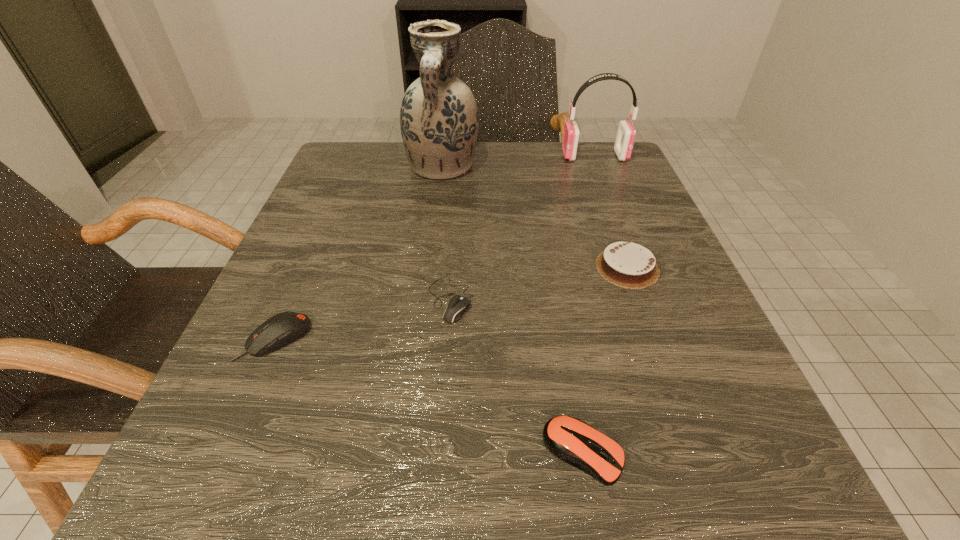
At what (x,y) coordinates should I click in order to perform the action: click on vacant space located on the outer surface of the earphone. Please return your answer as a coordinate pair (x, y). This screenshot has width=960, height=540. Looking at the image, I should click on (468, 156).

Where is `vacant space located 0.260m on the outer surface of the earphone`? Image resolution: width=960 pixels, height=540 pixels. vacant space located 0.260m on the outer surface of the earphone is located at coordinates (450, 156).

Where is `free spot located 0.150m on the front of the leftmost object`? free spot located 0.150m on the front of the leftmost object is located at coordinates (216, 475).

Identify the location of free spot located 0.140m on the left of the chocolate cake. (512, 268).

This screenshot has height=540, width=960. In order to click on free spot located 0.300m on the left of the fourth object from left to right in this screenshot , I will do `click(280, 452)`.

This screenshot has height=540, width=960. Find the location of `vacant region located 0.130m on the back of the second computer mouse from right to left`. vacant region located 0.130m on the back of the second computer mouse from right to left is located at coordinates (455, 229).

This screenshot has height=540, width=960. Find the location of `vase present at the far edge`. vase present at the far edge is located at coordinates (439, 122).

Identify the location of earphone that is at the far edge. (626, 133).

This screenshot has height=540, width=960. Find the location of `object situated at the near edge`. object situated at the near edge is located at coordinates (570, 439).

At what (x,y) coordinates should I click in order to perform the action: click on object located at the left edge. Please return your answer as a coordinate pair (x, y). The height and width of the screenshot is (540, 960). Looking at the image, I should click on (283, 328).